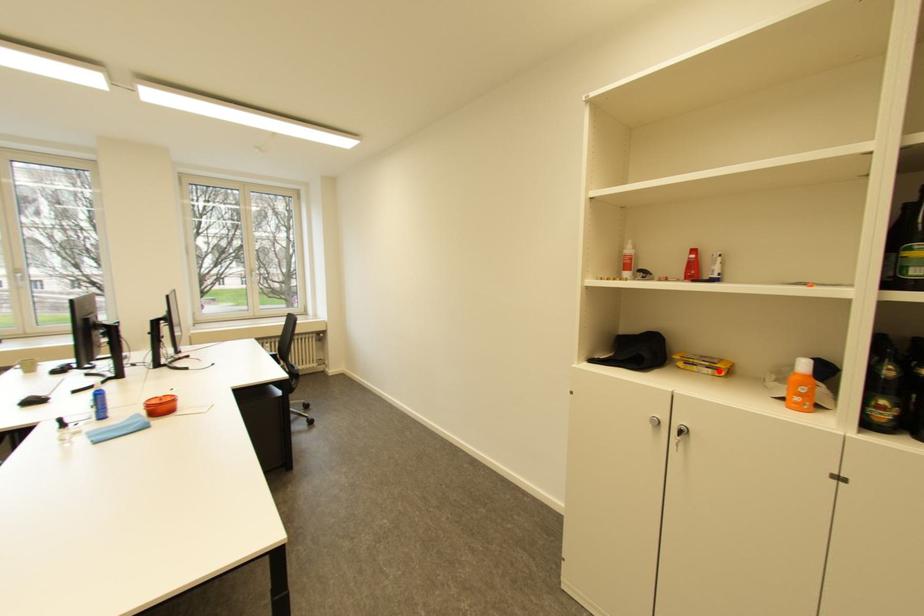
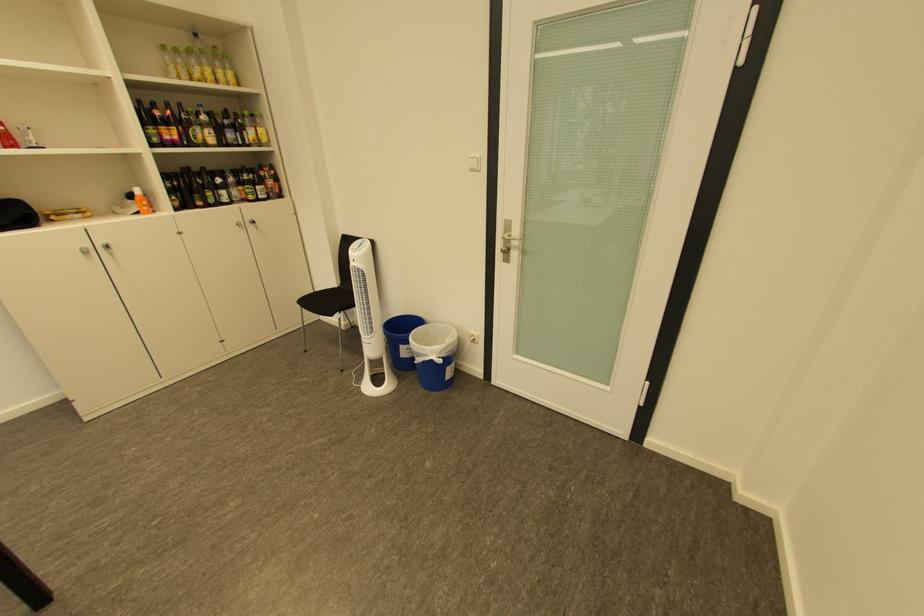
The point at the highlighted location is marked in the first image. Where is the corresponding point in the second image?

(90, 216)